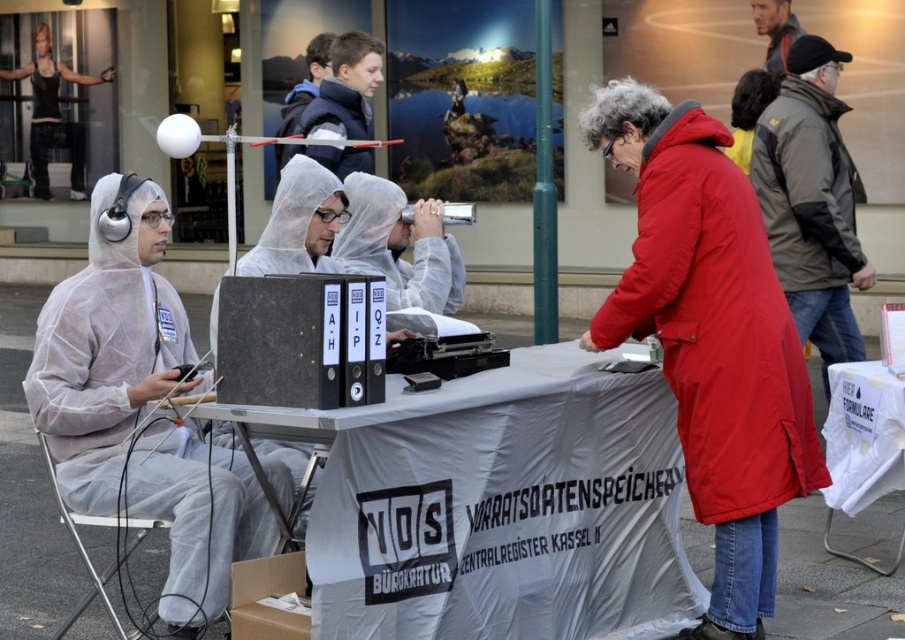
You are a photographer trying to capture a clear shot of the silver metallic telescope at center and the black tank top at upper left. Since you want both subjects to be in focus, you need to know their relative positions. Which object is located more to the left?

The black tank top at upper left is positioned on the left side of the silver metallic telescope at center, so the black tank top at upper left is more to the left.

Based on the photo, you are a fashion designer observing the outdoor scene. You notice the red matte coat at center and the dark gray jacket at right. Which clothing item would you recommend to a client who prefers larger, more voluminous designs?

The red matte coat at center has a larger size compared to the dark gray jacket at right, so it would be the better choice for someone preferring larger, more voluminous designs.